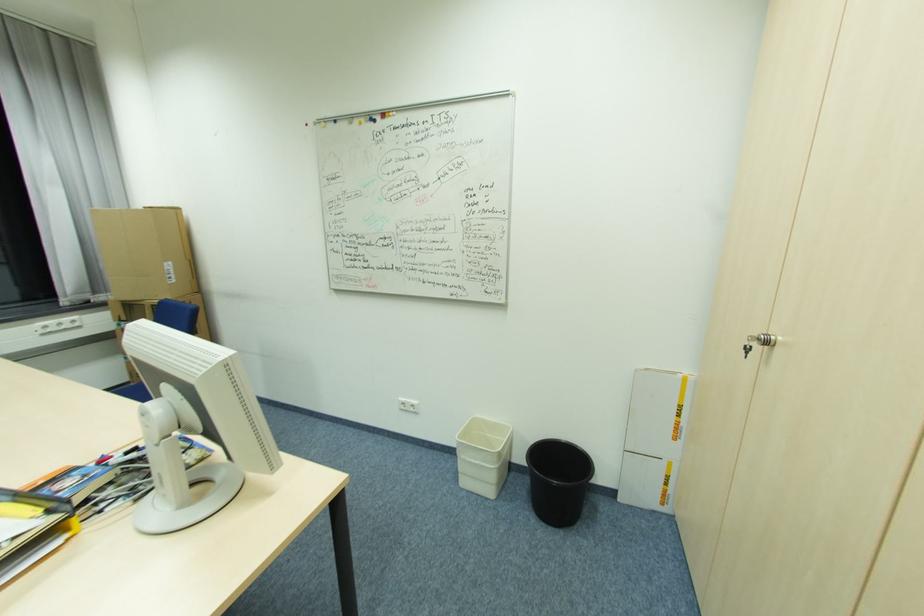
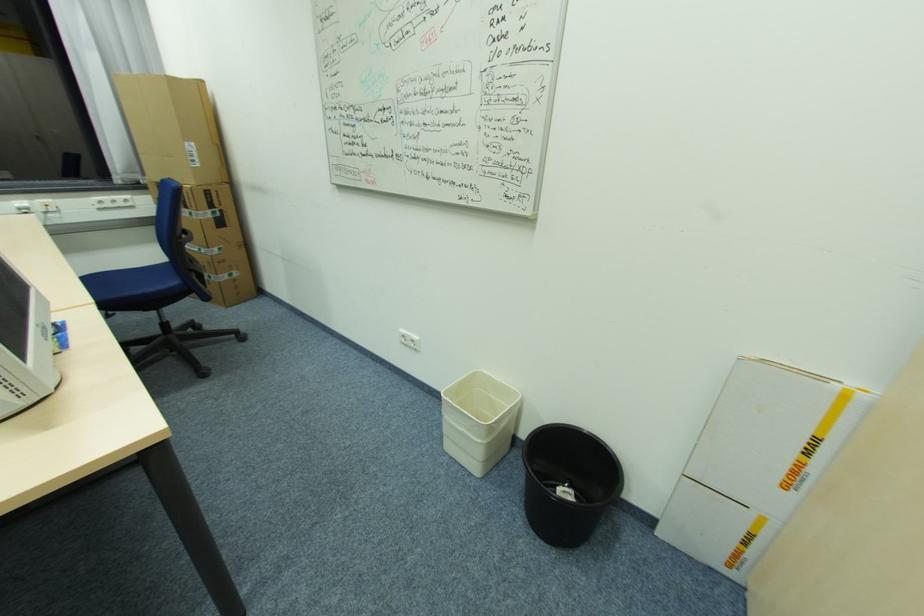
Question: How did the camera likely rotate?

Choices:
 (A) Left
 (B) Right
 (C) Up
 (D) Down

Answer: (A)